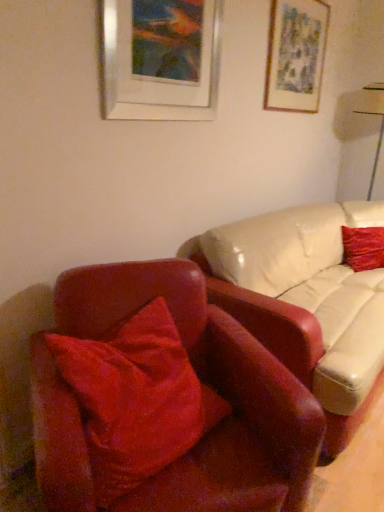
Find the location of a particular element. This screenshot has width=384, height=512. velvet red pillow at left, marked as the second pillow in a back-to-front arrangement is located at coordinates (136, 399).

Identify the location of white glossy table lamp at upper right. The width and height of the screenshot is (384, 512). (376, 115).

Describe the element at coordinates (296, 55) in the screenshot. I see `matte gray picture frame at upper right, the first picture frame viewed from the right` at that location.

I want to click on metallic silver picture frame at upper center, the second picture frame viewed from the back, so click(161, 59).

How distant is velvet red pillow at left, which appears as the second pillow when viewed from the top, from matte gray picture frame at upper right, the second picture frame viewed from the left?

6.89 feet.

From a real-world perspective, which is physically above, velvet red pillow at left, the 1th pillow when ordered from front to back, or matte gray picture frame at upper right, the first picture frame viewed from the right?

matte gray picture frame at upper right, the first picture frame viewed from the right, is physically above.

The height and width of the screenshot is (512, 384). In order to click on the 2nd picture frame behind the velvet red pillow at left, the 2th pillow in the right-to-left sequence in this screenshot , I will do `click(296, 55)`.

From the picture: Considering the positions of objects velvet red pillow at left, the 1th pillow when ordered from left to right, and metallic silver picture frame at upper center, positioned as the 1th picture frame in front-to-back order, in the image provided, who is more to the right, velvet red pillow at left, the 1th pillow when ordered from left to right, or metallic silver picture frame at upper center, positioned as the 1th picture frame in front-to-back order,?

From the viewer's perspective, metallic silver picture frame at upper center, positioned as the 1th picture frame in front-to-back order, appears more on the right side.

Where is `the 2nd pillow below when counting from the metallic silver picture frame at upper center, which appears as the first picture frame when viewed from the left (from the image's perspective)`? The image size is (384, 512). the 2nd pillow below when counting from the metallic silver picture frame at upper center, which appears as the first picture frame when viewed from the left (from the image's perspective) is located at coordinates (136, 399).

Which of these two, velvet red pillow at left, which appears as the second pillow when viewed from the top, or metallic silver picture frame at upper center, the second picture frame viewed from the right, is smaller?

Smaller between the two is metallic silver picture frame at upper center, the second picture frame viewed from the right.

From a real-world perspective, is velvet red pillow at left, which appears as the second pillow when viewed from the top, positioned under metallic silver picture frame at upper center, the second picture frame viewed from the back, based on gravity?

Indeed, from a real-world perspective, velvet red pillow at left, which appears as the second pillow when viewed from the top, is positioned beneath metallic silver picture frame at upper center, the second picture frame viewed from the back.

Which is more to the right, metallic silver picture frame at upper center, the second picture frame viewed from the right, or matte gray picture frame at upper right, the second picture frame viewed from the left?

matte gray picture frame at upper right, the second picture frame viewed from the left, is more to the right.

Which is behind, point (171, 63) or point (295, 29)?

The point (295, 29) is more distant.

Does metallic silver picture frame at upper center, the second picture frame viewed from the right, have a greater height compared to matte gray picture frame at upper right, the first picture frame viewed from the right?

Incorrect, the height of metallic silver picture frame at upper center, the second picture frame viewed from the right, is not larger of that of matte gray picture frame at upper right, the first picture frame viewed from the right.

How many degrees apart are the facing directions of matte gray picture frame at upper right, which is the 1th picture frame in back-to-front order, and velvet red pillow at right, the 2th pillow in the bottom-to-top sequence?

46.1 degrees separate the facing orientations of matte gray picture frame at upper right, which is the 1th picture frame in back-to-front order, and velvet red pillow at right, the 2th pillow in the bottom-to-top sequence.

Which of these two, matte gray picture frame at upper right, the first picture frame viewed from the right, or velvet red pillow at right, acting as the 2th pillow starting from the front, is thinner?

Thinner between the two is matte gray picture frame at upper right, the first picture frame viewed from the right.

In the image, is matte gray picture frame at upper right, the second picture frame viewed from the left, on the left side or the right side of velvet red pillow at right, the second pillow from the left?

From the image, it's evident that matte gray picture frame at upper right, the second picture frame viewed from the left, is to the left of velvet red pillow at right, the second pillow from the left.

Is matte gray picture frame at upper right, placed as the 2th picture frame when sorted from front to back, touching velvet red pillow at right, the second pillow from the left?

There is a gap between matte gray picture frame at upper right, placed as the 2th picture frame when sorted from front to back, and velvet red pillow at right, the second pillow from the left.

From the image's perspective, is matte gray picture frame at upper right, the first picture frame viewed from the right, on metallic silver picture frame at upper center, which appears as the first picture frame when viewed from the left?

Result: Yes.

Choose the correct answer: Is matte gray picture frame at upper right, the first picture frame viewed from the right, inside metallic silver picture frame at upper center, which appears as the first picture frame when viewed from the left, or outside it?

matte gray picture frame at upper right, the first picture frame viewed from the right, exists outside the volume of metallic silver picture frame at upper center, which appears as the first picture frame when viewed from the left.

Can you confirm if matte gray picture frame at upper right, the first picture frame viewed from the right, is wider than metallic silver picture frame at upper center, which appears as the first picture frame when viewed from the left?

Incorrect, the width of matte gray picture frame at upper right, the first picture frame viewed from the right, does not surpass that of metallic silver picture frame at upper center, which appears as the first picture frame when viewed from the left.

From a real-world perspective, is matte gray picture frame at upper right, the first picture frame viewed from the right, on top of metallic silver picture frame at upper center, positioned as the 1th picture frame in front-to-back order?

Yes, from a real-world perspective, matte gray picture frame at upper right, the first picture frame viewed from the right, is above metallic silver picture frame at upper center, positioned as the 1th picture frame in front-to-back order.

In terms of size, does white glossy table lamp at upper right appear bigger or smaller than matte gray picture frame at upper right, placed as the 2th picture frame when sorted from front to back?

Clearly, white glossy table lamp at upper right is larger in size than matte gray picture frame at upper right, placed as the 2th picture frame when sorted from front to back.

In order to click on table lamp to the right of matte gray picture frame at upper right, the first picture frame viewed from the right in this screenshot , I will do `click(376, 115)`.

Is white glossy table lamp at upper right looking in the opposite direction of matte gray picture frame at upper right, placed as the 2th picture frame when sorted from front to back?

That's not correct — white glossy table lamp at upper right is not looking away from matte gray picture frame at upper right, placed as the 2th picture frame when sorted from front to back.

Could matte gray picture frame at upper right, which is the 1th picture frame in back-to-front order, be considered to be inside white glossy table lamp at upper right?

No, matte gray picture frame at upper right, which is the 1th picture frame in back-to-front order, is not surrounded by white glossy table lamp at upper right.

Is velvet red pillow at right, the first pillow from the right, wider or thinner than velvet red pillow at left, the 1th pillow when ordered from front to back?

In the image, velvet red pillow at right, the first pillow from the right, appears to be more narrow than velvet red pillow at left, the 1th pillow when ordered from front to back.

Is velvet red pillow at right, which appears as the 1th pillow when viewed from the top, smaller than velvet red pillow at left, which appears as the second pillow when viewed from the top?

Yes.

Could you tell me if velvet red pillow at right, the 2th pillow in the bottom-to-top sequence, is turned towards velvet red pillow at left, the 2th pillow in the right-to-left sequence?

No.

Does velvet red pillow at right, the 2th pillow in the bottom-to-top sequence, appear on the right side of velvet red pillow at left, the 1th pillow when ordered from left to right?

Yes, velvet red pillow at right, the 2th pillow in the bottom-to-top sequence, is to the right of velvet red pillow at left, the 1th pillow when ordered from left to right.

Where is `pillow to the left of matte gray picture frame at upper right, which is the 1th picture frame in back-to-front order`? pillow to the left of matte gray picture frame at upper right, which is the 1th picture frame in back-to-front order is located at coordinates (136, 399).

Where is `pillow lying in front of the metallic silver picture frame at upper center, positioned as the 1th picture frame in front-to-back order`? Image resolution: width=384 pixels, height=512 pixels. pillow lying in front of the metallic silver picture frame at upper center, positioned as the 1th picture frame in front-to-back order is located at coordinates (136, 399).

Based on the photo, from the image, which object appears to be farther from velvet red pillow at left, which appears as the second pillow when viewed from the top, white glossy table lamp at upper right or matte gray picture frame at upper right, the second picture frame viewed from the left?

Based on the image, white glossy table lamp at upper right appears to be further to velvet red pillow at left, which appears as the second pillow when viewed from the top.

From the picture: From the image, which object appears to be nearer to metallic silver picture frame at upper center, the second picture frame viewed from the right, matte gray picture frame at upper right, the first picture frame viewed from the right, or velvet red pillow at right, the first pillow from the right?

The object closer to metallic silver picture frame at upper center, the second picture frame viewed from the right, is matte gray picture frame at upper right, the first picture frame viewed from the right.

From the image, which object appears to be farther from white glossy table lamp at upper right, velvet red pillow at left, the 2th pillow in the right-to-left sequence, or velvet red pillow at right, the second pillow from the left?

Based on the image, velvet red pillow at left, the 2th pillow in the right-to-left sequence, appears to be further to white glossy table lamp at upper right.

Looking at the image, which one is located closer to velvet red pillow at left, the 1th pillow when ordered from front to back, white glossy table lamp at upper right or metallic silver picture frame at upper center, the second picture frame viewed from the right?

metallic silver picture frame at upper center, the second picture frame viewed from the right, is closer to velvet red pillow at left, the 1th pillow when ordered from front to back.

From the image, which object appears to be farther from white glossy table lamp at upper right, matte gray picture frame at upper right, which is the 1th picture frame in back-to-front order, or velvet red pillow at right, the first pillow in the back-to-front sequence?

Based on the image, velvet red pillow at right, the first pillow in the back-to-front sequence, appears to be further to white glossy table lamp at upper right.

From the image, which object appears to be nearer to matte gray picture frame at upper right, placed as the 2th picture frame when sorted from front to back, velvet red pillow at right, the second pillow from the left, or velvet red pillow at left, the 2th pillow in the right-to-left sequence?

velvet red pillow at right, the second pillow from the left, is positioned closer to the anchor matte gray picture frame at upper right, placed as the 2th picture frame when sorted from front to back.

When comparing their distances from matte gray picture frame at upper right, which is the 1th picture frame in back-to-front order, does metallic silver picture frame at upper center, the second picture frame viewed from the right, or velvet red pillow at right, which appears as the 1th pillow when viewed from the top, seem closer?

Among the two, metallic silver picture frame at upper center, the second picture frame viewed from the right, is located nearer to matte gray picture frame at upper right, which is the 1th picture frame in back-to-front order.

When comparing their distances from metallic silver picture frame at upper center, which appears as the first picture frame when viewed from the left, does matte gray picture frame at upper right, which is the 1th picture frame in back-to-front order, or velvet red pillow at left, marked as the second pillow in a back-to-front arrangement, seem closer?

matte gray picture frame at upper right, which is the 1th picture frame in back-to-front order, lies closer to metallic silver picture frame at upper center, which appears as the first picture frame when viewed from the left, than the other object.

This screenshot has height=512, width=384. I want to click on pillow situated between metallic silver picture frame at upper center, which appears as the first picture frame when viewed from the left, and white glossy table lamp at upper right from left to right, so click(x=363, y=248).

Locate an element on the screen. This screenshot has height=512, width=384. picture frame between matte gray picture frame at upper right, the second picture frame viewed from the left, and velvet red pillow at left, which appears as the second pillow when viewed from the top, in the up-down direction is located at coordinates (161, 59).

At what (x,y) coordinates should I click in order to perform the action: click on pillow between velvet red pillow at left, which appears as the second pillow when viewed from the top, and white glossy table lamp at upper right, along the z-axis. Please return your answer as a coordinate pair (x, y). Looking at the image, I should click on click(363, 248).

You are a GUI agent. You are given a task and a screenshot of the screen. Output one action in this format:
    pyautogui.click(x=<x>, y=<y>)
    Task: Click on the picture frame located between metallic silver picture frame at upper center, which appears as the first picture frame when viewed from the left, and white glossy table lamp at upper right in the depth direction
    This screenshot has width=384, height=512.
    Given the screenshot: What is the action you would take?
    pyautogui.click(x=296, y=55)